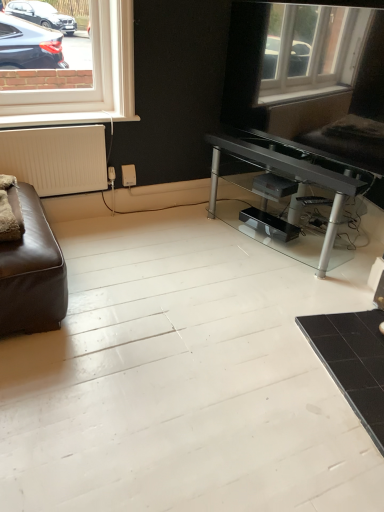
Question: Is black matte table at lower right spatially inside white matte radiator at left, or outside of it?

Choices:
 (A) inside
 (B) outside

Answer: (B)

Question: Is black matte table at lower right taller or shorter than white matte radiator at left?

Choices:
 (A) short
 (B) tall

Answer: (A)

Question: From a real-world perspective, is black matte table at lower right above or below white matte radiator at left?

Choices:
 (A) above
 (B) below

Answer: (B)

Question: From the image's perspective, is white matte radiator at left above or below black matte table at lower right?

Choices:
 (A) below
 (B) above

Answer: (B)

Question: Does point (92, 160) appear closer or farther from the camera than point (354, 373)?

Choices:
 (A) farther
 (B) closer

Answer: (A)

Question: Do you think white matte radiator at left is within black matte table at lower right, or outside of it?

Choices:
 (A) inside
 (B) outside

Answer: (B)

Question: In terms of height, does white matte radiator at left look taller or shorter compared to black matte table at lower right?

Choices:
 (A) short
 (B) tall

Answer: (B)